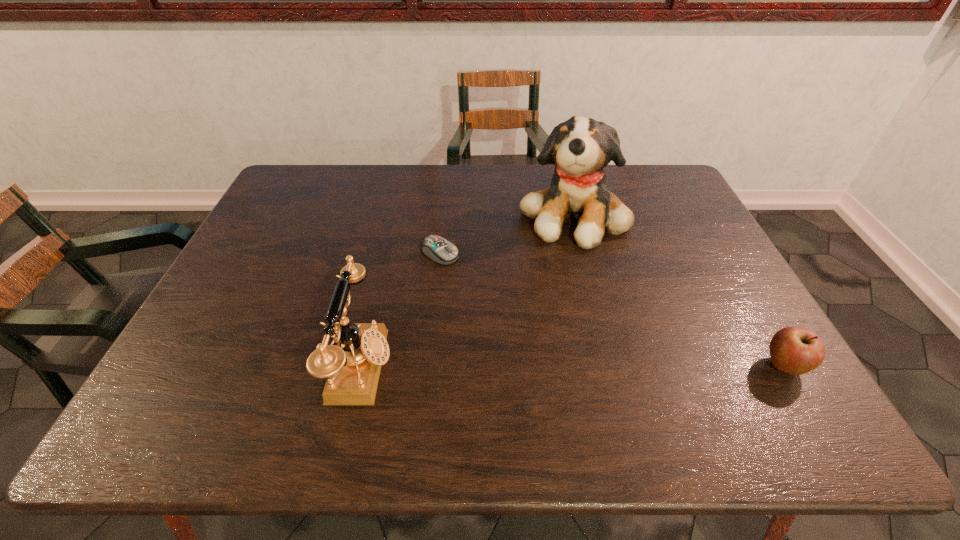
Where is `telephone`? Image resolution: width=960 pixels, height=540 pixels. telephone is located at coordinates (352, 368).

Find the location of a particular element. the second tallest object is located at coordinates (352, 368).

Locate an element on the screen. the rightmost object is located at coordinates pos(793,350).

Identify the location of the second shortest object. This screenshot has height=540, width=960. (793, 350).

Locate an element on the screen. The width and height of the screenshot is (960, 540). the second object from right to left is located at coordinates (580, 148).

You are a GUI agent. You are given a task and a screenshot of the screen. Output one action in this format:
    pyautogui.click(x=<x>, y=<y>)
    Task: Click on the tallest object
    The image size is (960, 540).
    Given the screenshot: What is the action you would take?
    pyautogui.click(x=580, y=148)

Where is `the third object from right to left`? The image size is (960, 540). the third object from right to left is located at coordinates (436, 248).

Locate an element on the screen. computer mouse is located at coordinates (436, 248).

At what (x,y) coordinates should I click in order to perform the action: click on free space located on the dial of the telephone. Please return your answer as a coordinate pair (x, y). The height and width of the screenshot is (540, 960). Looking at the image, I should click on (495, 367).

You are a GUI agent. You are given a task and a screenshot of the screen. Output one action in this format:
    pyautogui.click(x=<x>, y=<y>)
    Task: Click on the vacant space located 0.250m on the left of the apple
    
    Given the screenshot: What is the action you would take?
    pyautogui.click(x=649, y=366)